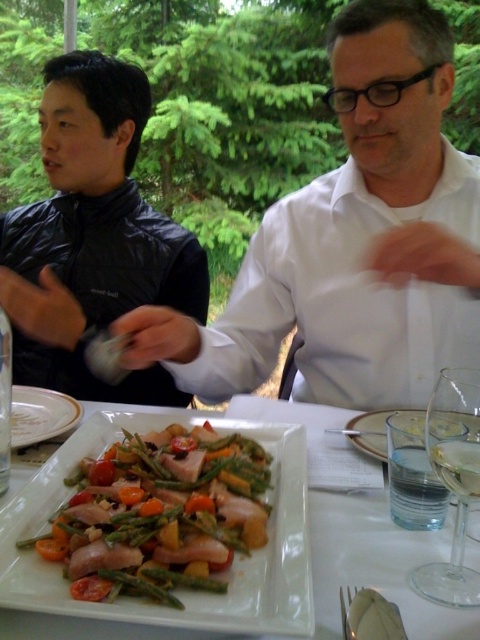
Does white glossy shirt at upper center appear on the right side of transparent glass wine glass at lower right?

No, white glossy shirt at upper center is not to the right of transparent glass wine glass at lower right.

Locate an element on the screen. The width and height of the screenshot is (480, 640). white glossy shirt at upper center is located at coordinates (352, 243).

Is white glossy plate at center smaller than clear glass plate at center?

No.

Is point (376, 497) positioned behind point (368, 433)?

No, (376, 497) is closer to viewer.

This screenshot has width=480, height=640. Identify the location of white glossy plate at center. (377, 563).

Between white glossy shirt at upper center and white glossy plate at center, which one is positioned higher?

Positioned higher is white glossy shirt at upper center.

Who is shorter, white glossy shirt at upper center or white glossy plate at center?

Standing shorter between the two is white glossy plate at center.

Which is in front, point (215, 340) or point (412, 564)?

Point (412, 564)

I want to click on white glossy shirt at upper center, so click(x=352, y=243).